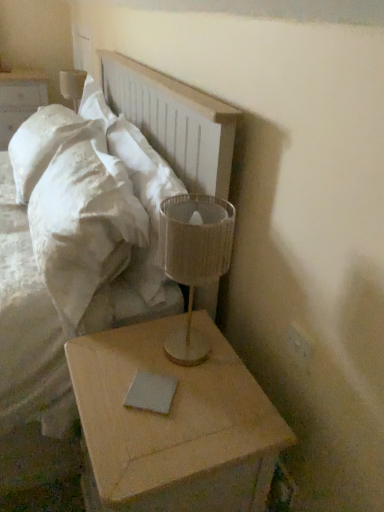
The image size is (384, 512). Identify the location of free space in front of translucent fabric lampshade at right, which is counted as the 2th table lamp, starting from the back. (199, 412).